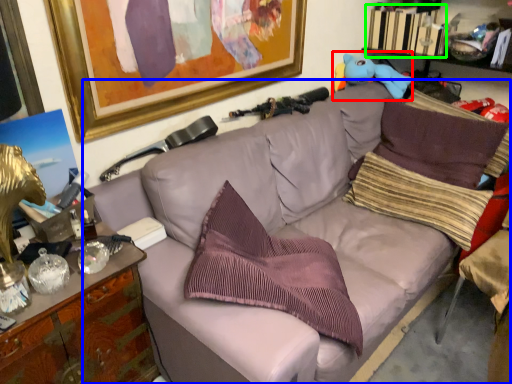
Question: Estimate the real-world distances between objects in this image. Which object is closer to toy (highlighted by a red box), studio couch (highlighted by a blue box) or book (highlighted by a green box)?

Choices:
 (A) studio couch
 (B) book

Answer: (B)